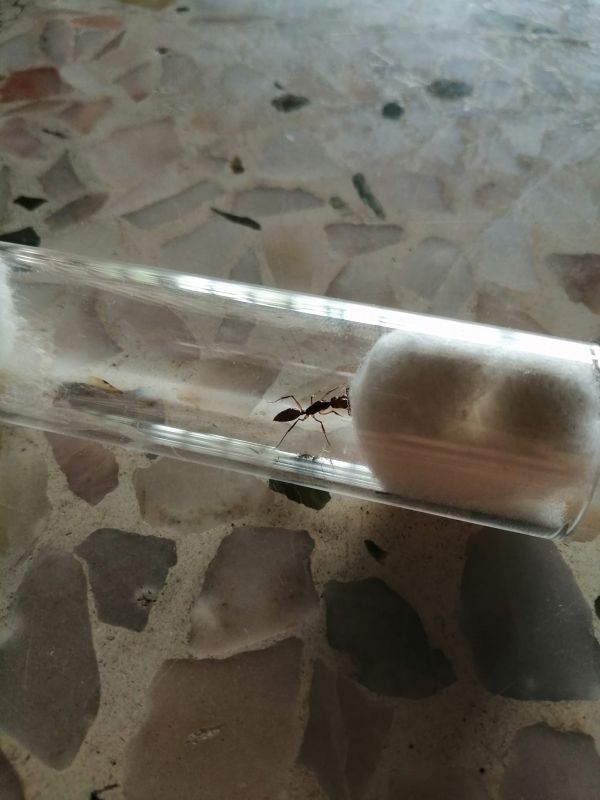
Locate an element on the screen. The height and width of the screenshot is (800, 600). plug is located at coordinates (591, 516).